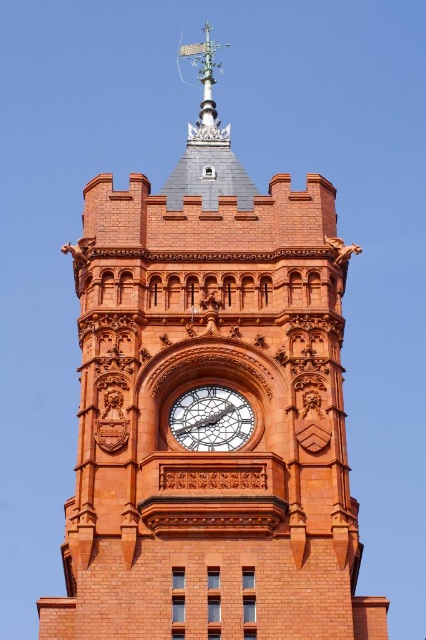
You are standing in front of the clock tower and want to adjust the weathervane. Which direction should you move from the polished brass clock at center to reach the silver metallic weathervane at upper center?

The silver metallic weathervane at upper center is to the left of the polished brass clock at center. So you should move to the left from the polished brass clock at center to reach the silver metallic weathervane at upper center.

You are an architect analyzing the clock tower design. You need to determine the position of the silver metallic weathervane at upper center relative to the tower structure. What are its coordinates in the image?

The silver metallic weathervane at upper center is located at coordinates point (207, 147).

You are standing in front of the clock tower and notice two points marked on its facade. The first point is at coordinate point(230,172) and the second is at point(204,426). Which point is closer to you?

Point(230,172) is closer to you because it is further to the viewer than point(204,426).